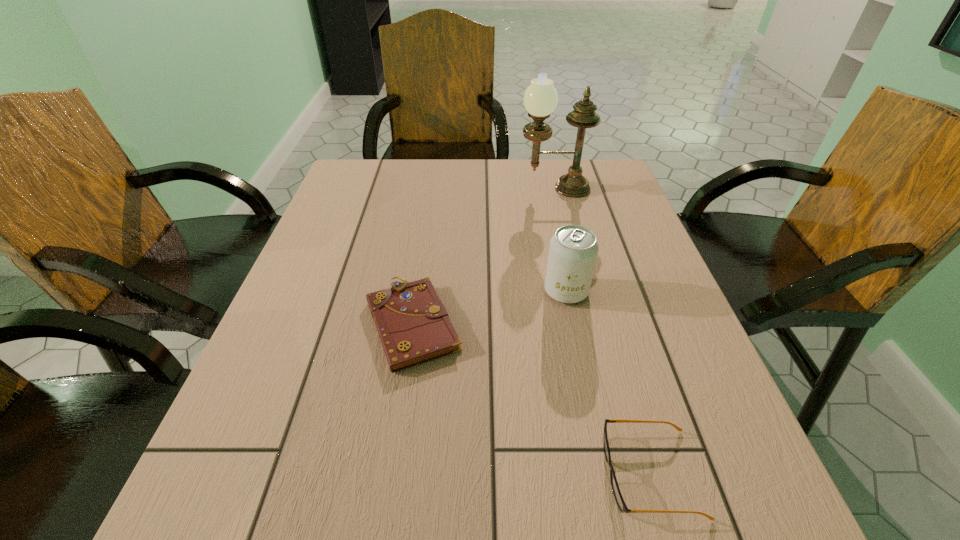
Locate an element on the screen. vacant space at the left edge of the desktop is located at coordinates (324, 235).

In the image, there is a desktop. Identify the location of vacant space at the right edge. The image size is (960, 540). (651, 319).

This screenshot has height=540, width=960. Identify the location of free space at the far left corner of the desktop. (380, 191).

In the image, there is a desktop. Identify the location of free space at the near right corner. This screenshot has width=960, height=540. (718, 528).

The height and width of the screenshot is (540, 960). Identify the location of vacant space in between the tallest object and the notebook. (483, 256).

Identify the location of free point between the spectacles and the soda can. This screenshot has width=960, height=540. (609, 382).

The height and width of the screenshot is (540, 960). In order to click on empty space that is in between the farthest object and the leftmost object in this screenshot , I will do `click(483, 256)`.

You are a GUI agent. You are given a task and a screenshot of the screen. Output one action in this format:
    pyautogui.click(x=<x>, y=<y>)
    Task: Click on the free space between the nearest object and the soda can
    Image resolution: width=960 pixels, height=540 pixels.
    Given the screenshot: What is the action you would take?
    pyautogui.click(x=609, y=382)

Where is `free space between the shortest object and the nearest object`? free space between the shortest object and the nearest object is located at coordinates (532, 398).

The width and height of the screenshot is (960, 540). I want to click on free space between the nearest object and the notebook, so click(532, 398).